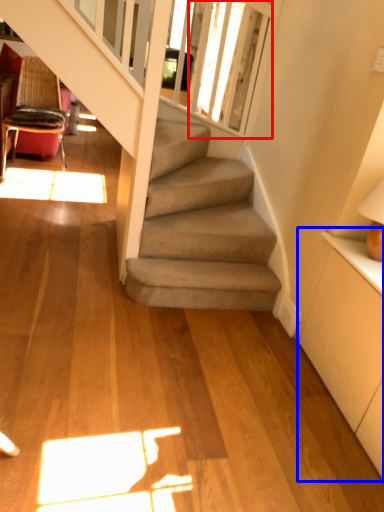
Question: Among these objects, which one is nearest to the camera, window screen (highlighted by a red box) or dresser (highlighted by a blue box)?

Choices:
 (A) window screen
 (B) dresser

Answer: (B)